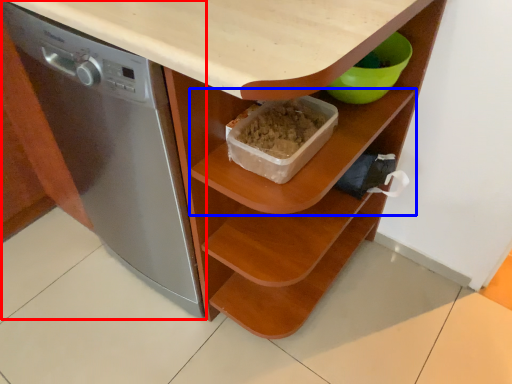
Question: Which point is closer to the camera, home appliance (highlighted by a red box) or shelf (highlighted by a blue box)?

Choices:
 (A) home appliance
 (B) shelf

Answer: (A)